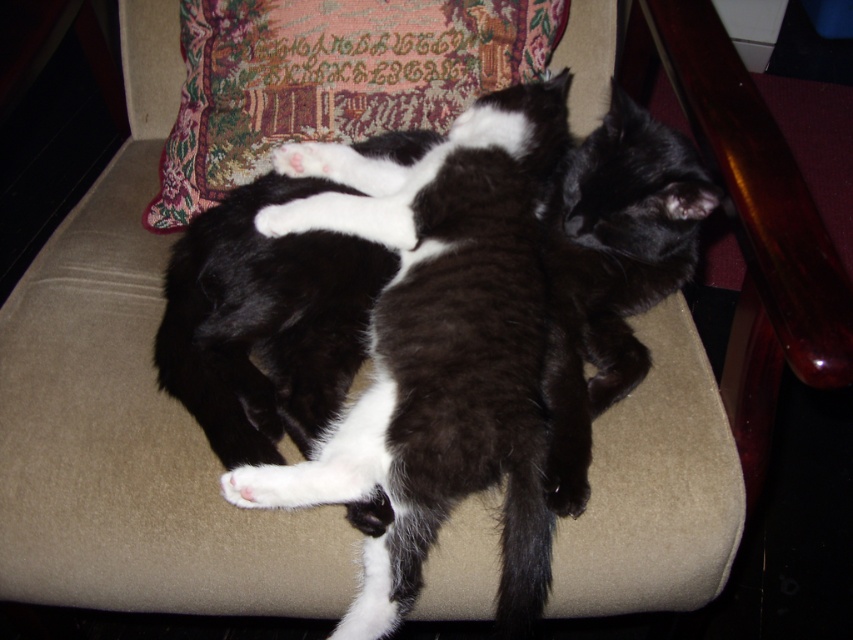
You are taking a photo of two kittens on a chair. The first kitten is at point (310, 228) and the second kitten is at point (463, 16). Which kitten will appear larger in your photo?

Point (310, 228) is closer to the camera than point (463, 16). Therefore, the kitten at point (310, 228) will appear larger in the photo.

Based on the coordinates provided in the scene description, where is the soft fur cat at center located?

The soft fur cat at center is located at coordinates point [437,349].

You are a cat owner who wants to place a new toy between the soft fur cat at center and the velvet cushion at upper center. Based on the scene, where should you place the toy to ensure it is between them?

The soft fur cat at center is below the velvet cushion at upper center, so placing the toy between them would require positioning it above the soft fur cat at center and below the velvet cushion at upper center.